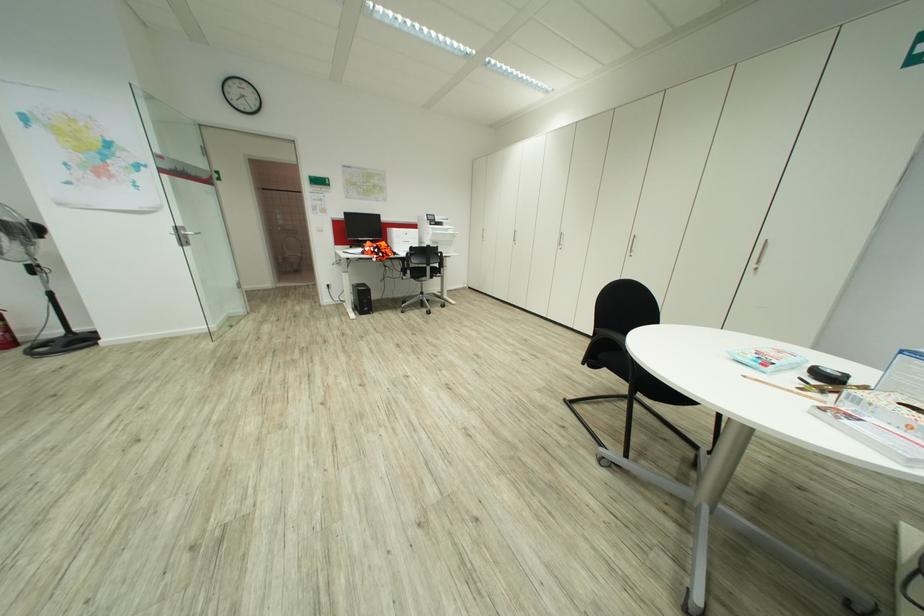
Find where to lift the black tape measure. Please return your answer as a coordinate pair (x, y).

(827, 376)